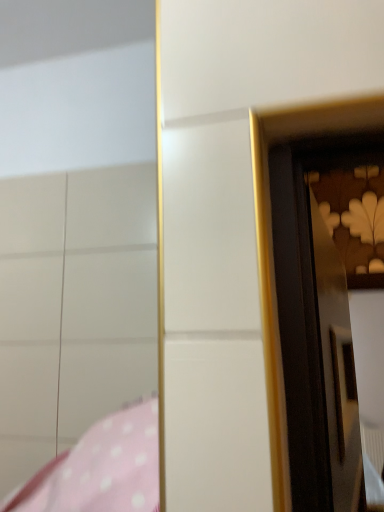
Where is `pink dotted fabric at lower left`? The height and width of the screenshot is (512, 384). pink dotted fabric at lower left is located at coordinates (105, 468).

Describe the element at coordinates (105, 468) in the screenshot. I see `pink dotted fabric at lower left` at that location.

Looking at this image, in order to face pink dotted fabric at lower left, should I rotate leftwards or rightwards?

You should look left and rotate roughly 19.096 degrees.

Where is `pink dotted fabric at lower left`? Image resolution: width=384 pixels, height=512 pixels. pink dotted fabric at lower left is located at coordinates (105, 468).